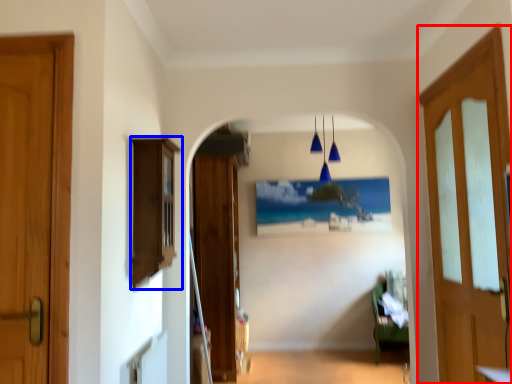
Question: Which point is closer to the camera, door (highlighted by a red box) or cabinetry (highlighted by a blue box)?

Choices:
 (A) door
 (B) cabinetry

Answer: (A)